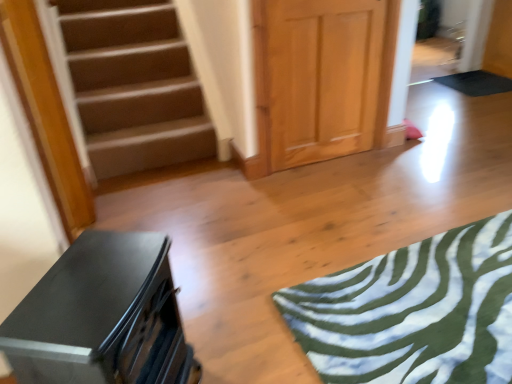
Find the location of a particular element. The image size is (512, 384). free space above matte black dresser at lower left (from a real-world perspective) is located at coordinates (96, 276).